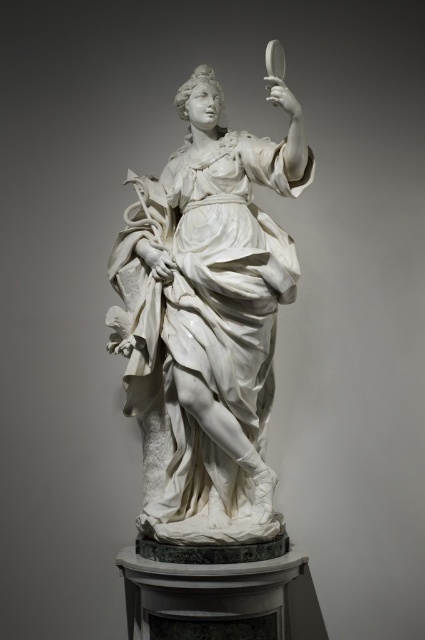
Does point (229, 308) lie behind point (269, 65)?

That is True.

Is the position of white marble statue at center more distant than that of transparent glass magnifying glass at upper right?

No, white marble statue at center is in front of transparent glass magnifying glass at upper right.

What do you see at coordinates (209, 314) in the screenshot? The image size is (425, 640). I see `white marble statue at center` at bounding box center [209, 314].

This screenshot has width=425, height=640. I want to click on white marble statue at center, so click(x=209, y=314).